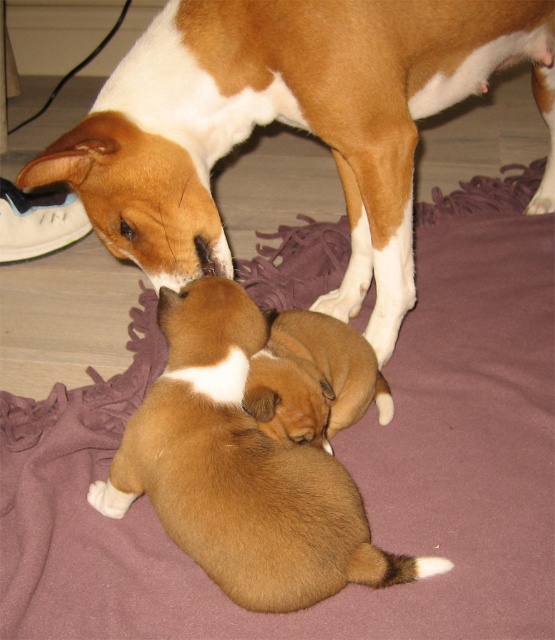
You are a veterinarian examining the image of a mother dog and her puppies. Based on the scene, which object is larger in size between the brown matte dog at center and the brown furry puppies at lower center?

The brown matte dog at center is bigger than the brown furry puppies at lower center.

You are a photographer taking a picture of the brown furry puppies at lower center and the brown furry puppy at center. Which puppy is located to the right of the other?

The brown furry puppy at center is located to the right of the brown furry puppies at lower center.

You are a dog owner observing the scene. The brown matte dog at center is protecting her puppies. Which direction should you approach from to avoid disturbing the brown furry puppies at lower center?

The brown matte dog at center is positioned over the brown furry puppies at lower center, so approaching from the sides or behind the brown matte dog at center would be less likely to disturb the puppies.